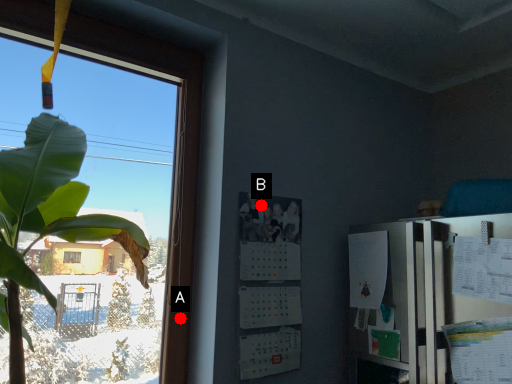
Question: Two points are circled on the image, labeled by A and B beside each circle. Which point is farther to the camera?

Choices:
 (A) A is further
 (B) B is further

Answer: (B)